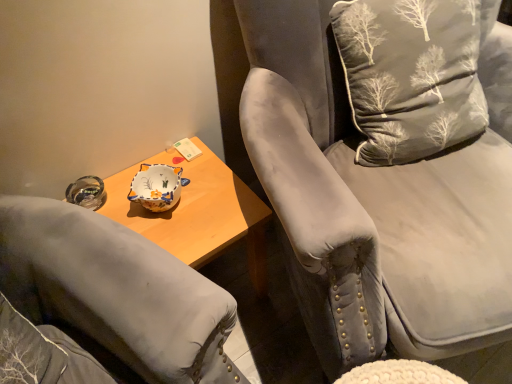
Question: From their relative heights in the image, would you say velvet gray chair at upper right is taller or shorter than silvery fabric cushion at upper right?

Choices:
 (A) short
 (B) tall

Answer: (B)

Question: Does point (369, 64) appear closer or farther from the camera than point (423, 147)?

Choices:
 (A) closer
 (B) farther

Answer: (A)

Question: Considering the relative positions of velvet gray chair at upper right and silvery fabric cushion at upper right in the image provided, is velvet gray chair at upper right to the left or to the right of silvery fabric cushion at upper right?

Choices:
 (A) right
 (B) left

Answer: (A)

Question: From the image's perspective, is silvery fabric cushion at upper right above or below velvet gray chair at upper right?

Choices:
 (A) above
 (B) below

Answer: (A)

Question: Based on their positions, is silvery fabric cushion at upper right located to the left or right of velvet gray chair at upper right?

Choices:
 (A) right
 (B) left

Answer: (B)

Question: Do you think silvery fabric cushion at upper right is within velvet gray chair at upper right, or outside of it?

Choices:
 (A) outside
 (B) inside

Answer: (B)

Question: Is silvery fabric cushion at upper right bigger or smaller than velvet gray chair at upper right?

Choices:
 (A) big
 (B) small

Answer: (B)